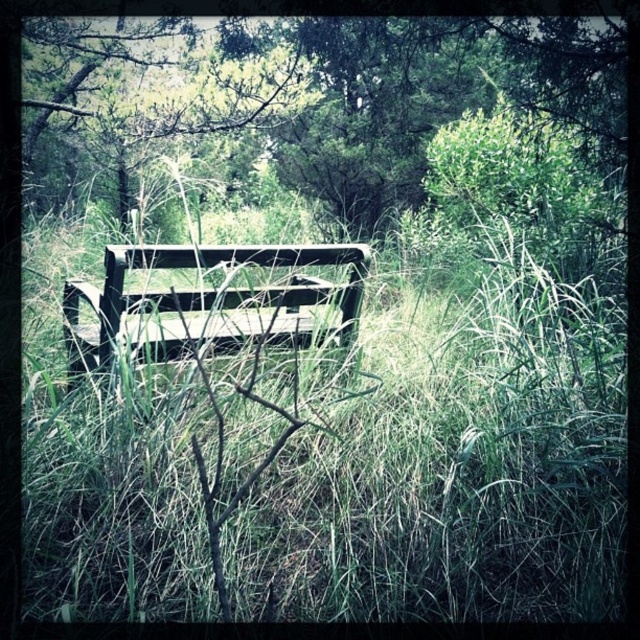
Question: Is green matte bench at center bigger than wooden park bench at center?

Choices:
 (A) yes
 (B) no

Answer: (A)

Question: Which point is closer to the camera?

Choices:
 (A) (440, 102)
 (B) (241, 253)

Answer: (B)

Question: Can you confirm if green matte bench at center is wider than wooden park bench at center?

Choices:
 (A) no
 (B) yes

Answer: (B)

Question: Among these objects, which one is farthest from the camera?

Choices:
 (A) green matte bench at center
 (B) wooden park bench at center

Answer: (A)

Question: Among these objects, which one is nearest to the camera?

Choices:
 (A) green matte bench at center
 (B) wooden park bench at center

Answer: (B)

Question: Is green matte bench at center positioned in front of wooden park bench at center?

Choices:
 (A) yes
 (B) no

Answer: (B)